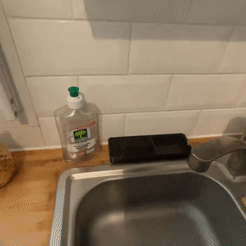
Locate an element on the screen. sticker on detergent bottle is located at coordinates (84, 142).